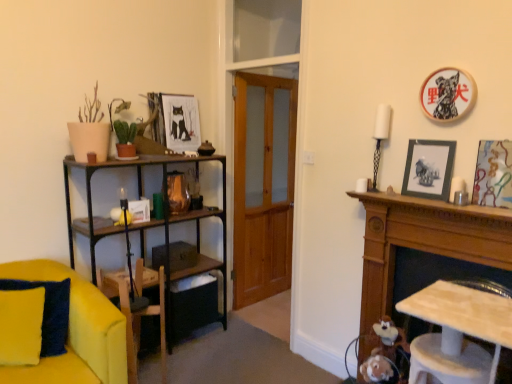
Question: Is metallic silver picture frame at right, placed as the first picture frame when sorted from right to left, taller or shorter than wooden armchair at lower left?

Choices:
 (A) tall
 (B) short

Answer: (B)

Question: Is metallic silver picture frame at right, acting as the 4th picture frame starting from the back, in front of or behind wooden armchair at lower left in the image?

Choices:
 (A) front
 (B) behind

Answer: (A)

Question: Which object is the farthest from the matte black picture frame at upper right, which is the 2th picture frame from left to right?

Choices:
 (A) matte paper picture frame at upper center, which is the fourth picture frame in right-to-left order
 (B) black glossy picture frame at upper right, the second picture frame from the right
 (C) metallic silver picture frame at right, arranged as the fourth picture frame when viewed from the left
 (D) wooden armchair at lower left
 (E) yellow fabric cushion at lower left

Answer: (E)

Question: Which is farther from the matte paper picture frame at upper center, which appears as the first picture frame when viewed from the back?

Choices:
 (A) black glossy picture frame at upper right, which is the 2th picture frame from front to back
 (B) wooden mantelpiece at right
 (C) matte black picture frame at upper right, which is the third picture frame in front-to-back order
 (D) wooden armchair at lower left
 (E) metallic silver picture frame at right, arranged as the fourth picture frame when viewed from the left

Answer: (E)